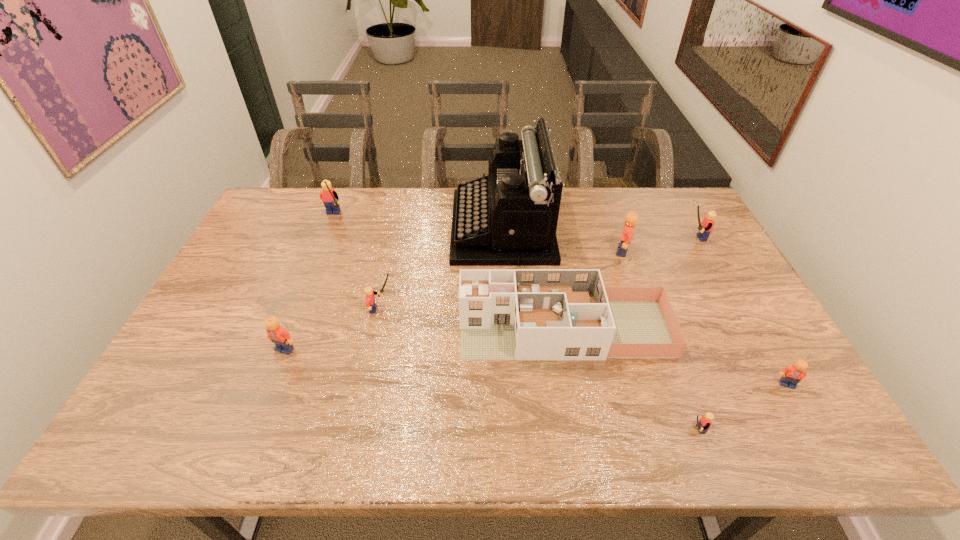
Identify the location of the leftmost orange Lego. This screenshot has height=540, width=960. (277, 334).

Where is `the second nearest yellow Lego`? The image size is (960, 540). the second nearest yellow Lego is located at coordinates (370, 298).

Identify the location of the third object from left to right. (370, 298).

Locate an element on the screen. The height and width of the screenshot is (540, 960). the nearest orange Lego is located at coordinates (x=792, y=375).

The width and height of the screenshot is (960, 540). Find the location of `the smallest orange Lego`. the smallest orange Lego is located at coordinates (792, 375).

Identify the location of the nearest yellow Lego. This screenshot has height=540, width=960. (704, 423).

This screenshot has height=540, width=960. I want to click on the nearest Lego, so click(704, 423).

Identify the location of vacant space located 0.390m on the typing side of the tallest object. The width and height of the screenshot is (960, 540). (339, 227).

Identify the location of free space located on the typing side of the tallest object. The height and width of the screenshot is (540, 960). (368, 227).

Where is `blank space located 0.130m on the typing side of the tallest object`? Image resolution: width=960 pixels, height=540 pixels. blank space located 0.130m on the typing side of the tallest object is located at coordinates (415, 227).